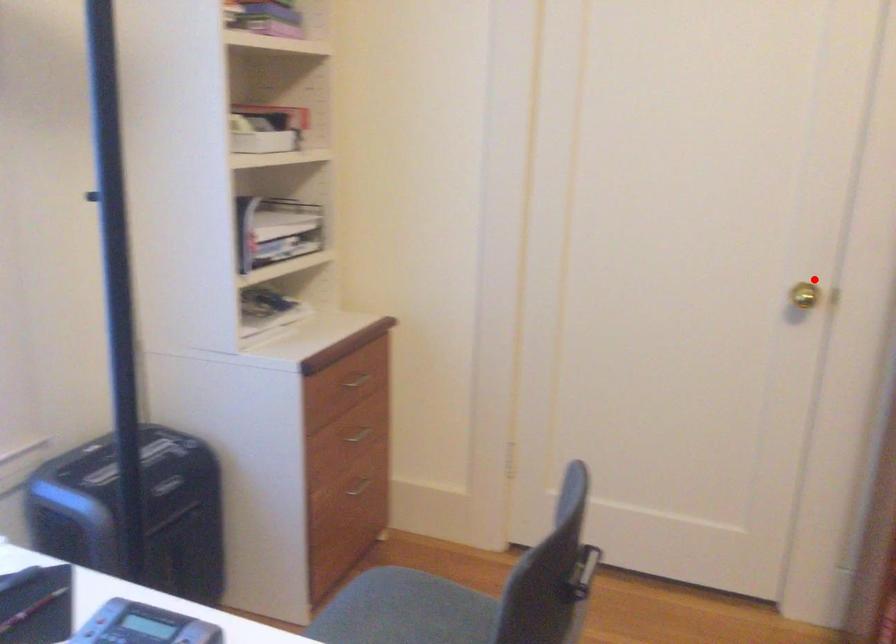
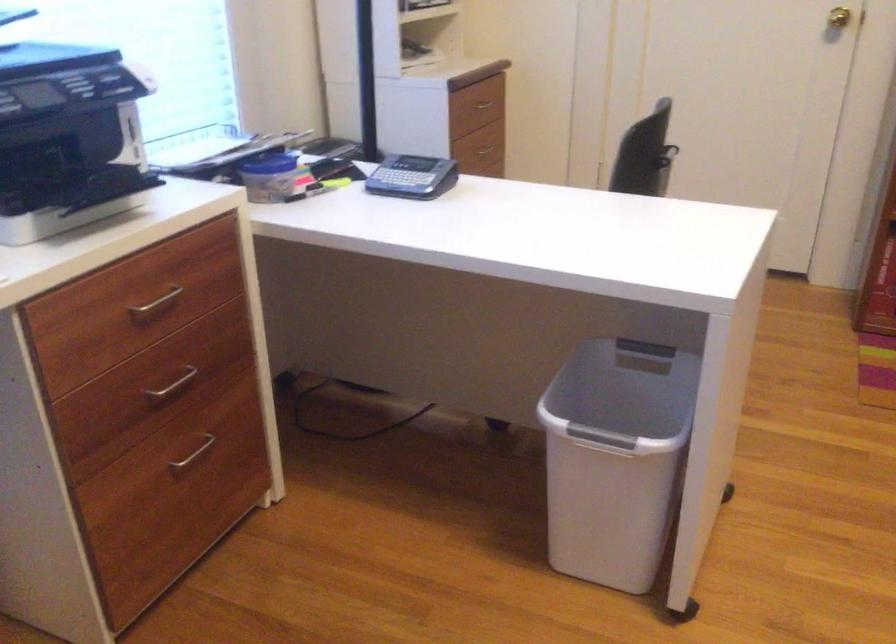
The point at the highlighted location is marked in the first image. Where is the corresponding point in the second image?

(839, 17)